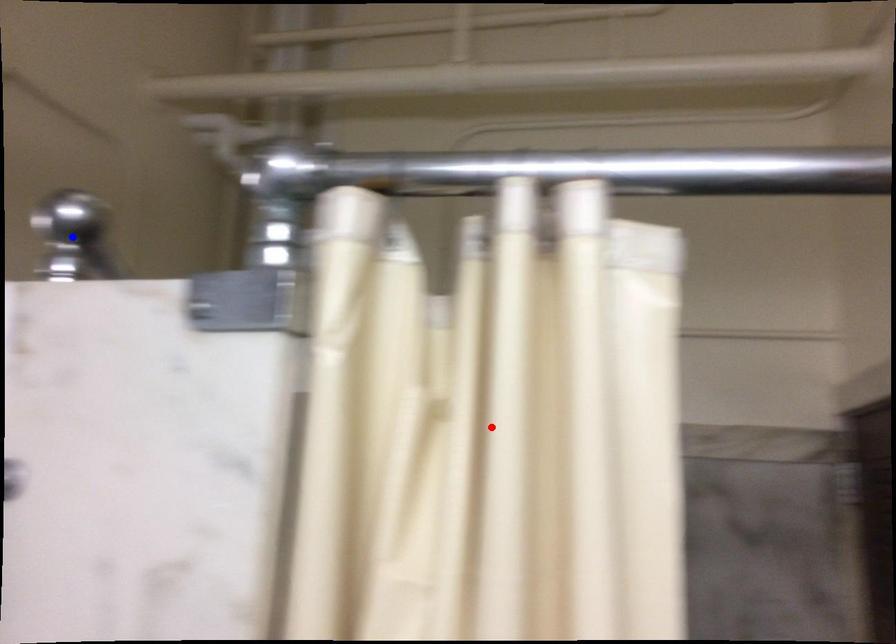
Question: In the image, two points are highlighted. Which point is nearer to the camera? Reply with the corresponding letter.

Choices:
 (A) blue point
 (B) red point

Answer: (B)